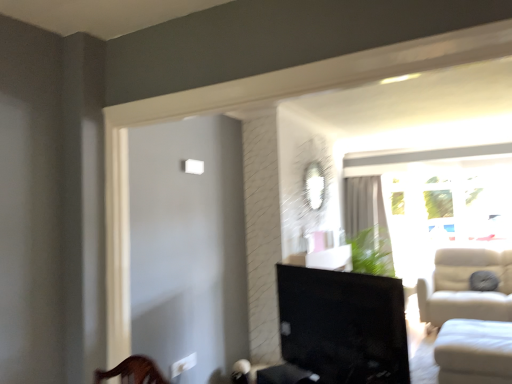
What are the coordinates of `white fabric studio couch at lower right` in the screenshot? It's located at (474, 351).

You are a GUI agent. You are given a task and a screenshot of the screen. Output one action in this format:
    pyautogui.click(x=<x>, y=<y>)
    Task: Click on the white sheer curtain at upper right
    This screenshot has width=512, height=384.
    Given the screenshot: What is the action you would take?
    pyautogui.click(x=367, y=226)

The image size is (512, 384). Describe the element at coordinates (440, 199) in the screenshot. I see `transparent glass window at right` at that location.

What is the approximate height of transparent glass window at right?

transparent glass window at right is 1.73 meters tall.

Locate an element on the screen. The image size is (512, 384). matte black tv at center is located at coordinates (343, 325).

The image size is (512, 384). What are the coordinates of `white fabric studio couch at lower right` in the screenshot? It's located at (474, 351).

Can you confirm if white fabric studio couch at lower right is wider than white sheer curtain at upper right?

Yes.

Looking at this image, who is shorter, white fabric studio couch at lower right or white sheer curtain at upper right?

white fabric studio couch at lower right.

Looking at this image, considering the relative sizes of white fabric studio couch at lower right and white sheer curtain at upper right in the image provided, is white fabric studio couch at lower right smaller than white sheer curtain at upper right?

Actually, white fabric studio couch at lower right might be larger than white sheer curtain at upper right.

Considering the sizes of objects white sheer curtain at upper right and transparent glass window at right in the image provided, who is bigger, white sheer curtain at upper right or transparent glass window at right?

transparent glass window at right is bigger.

Looking at this image, is white sheer curtain at upper right in contact with transparent glass window at right?

There is a gap between white sheer curtain at upper right and transparent glass window at right.

Considering the relative sizes of white sheer curtain at upper right and transparent glass window at right in the image provided, is white sheer curtain at upper right shorter than transparent glass window at right?

Correct, white sheer curtain at upper right is not as tall as transparent glass window at right.

In the image, there is a transparent glass window at right. Where is `curtain below it (from the image's perspective)`? Image resolution: width=512 pixels, height=384 pixels. curtain below it (from the image's perspective) is located at coordinates (367, 226).

Are matte black tv at center and white sheer curtain at upper right beside each other?

No.

How far apart are matte black tv at center and white sheer curtain at upper right?

matte black tv at center is 2.39 meters away from white sheer curtain at upper right.

In terms of width, does matte black tv at center look wider or thinner when compared to white sheer curtain at upper right?

Considering their sizes, matte black tv at center looks slimmer than white sheer curtain at upper right.

The image size is (512, 384). Identify the location of curtain located above the matte black tv at center (from the image's perspective). (367, 226).

How different are the orientations of white sheer curtain at upper right and white fabric studio couch at lower right in degrees?

0.0261 degrees.

Is white sheer curtain at upper right looking in the opposite direction of white fabric studio couch at lower right?

No.

Between point (365, 228) and point (507, 376), which one is positioned behind?

The point (365, 228) is behind.

Who is bigger, white sheer curtain at upper right or white fabric studio couch at lower right?

Bigger between the two is white fabric studio couch at lower right.

How different are the orientations of transparent glass window at right and white sheer curtain at upper right in degrees?

The angular difference between transparent glass window at right and white sheer curtain at upper right is 1.31 degrees.

In the scene shown: Which of these two, transparent glass window at right or white sheer curtain at upper right, stands taller?

Standing taller between the two is transparent glass window at right.

Can we say transparent glass window at right lies outside white sheer curtain at upper right?

transparent glass window at right is positioned outside white sheer curtain at upper right.

From a real-world perspective, is transparent glass window at right located beneath white fabric studio couch at lower right?

Actually, transparent glass window at right is physically above white fabric studio couch at lower right in the real world.

Does transparent glass window at right turn towards white fabric studio couch at lower right?

Yes, transparent glass window at right is facing white fabric studio couch at lower right.

From the image's perspective, between transparent glass window at right and white fabric studio couch at lower right, who is located below?

Result: white fabric studio couch at lower right is shown below in the image.

In the scene shown: What's the angular difference between transparent glass window at right and white fabric studio couch at lower right's facing directions?

1.29 degrees.

Identify the location of furniture below the white sheer curtain at upper right (from the image's perspective). (343, 325).

Is white sheer curtain at upper right positioned before matte black tv at center?

No, white sheer curtain at upper right is behind matte black tv at center.

Is white sheer curtain at upper right thinner than matte black tv at center?

In fact, white sheer curtain at upper right might be wider than matte black tv at center.

Is white sheer curtain at upper right to the right of matte black tv at center from the viewer's perspective?

Yes, white sheer curtain at upper right is to the right of matte black tv at center.

This screenshot has width=512, height=384. I want to click on curtain above the white fabric studio couch at lower right (from a real-world perspective), so click(367, 226).

This screenshot has width=512, height=384. In the image, there is a white sheer curtain at upper right. Find the location of `window below it (from a real-world perspective)`. window below it (from a real-world perspective) is located at coordinates (440, 199).

When comparing their distances from white sheer curtain at upper right, does matte black tv at center or transparent glass window at right seem closer?

Among the two, transparent glass window at right is located nearer to white sheer curtain at upper right.

Looking at the image, which one is located closer to white fabric studio couch at lower right, white sheer curtain at upper right or matte black tv at center?

matte black tv at center.

Based on their spatial positions, is transparent glass window at right or matte black tv at center closer to white fabric studio couch at lower right?

matte black tv at center is closer to white fabric studio couch at lower right.

When comparing their distances from transparent glass window at right, does matte black tv at center or white fabric studio couch at lower right seem further?

matte black tv at center lies further to transparent glass window at right than the other object.

Based on their spatial positions, is white sheer curtain at upper right or white fabric studio couch at lower right closer to transparent glass window at right?

white sheer curtain at upper right is positioned closer to the anchor transparent glass window at right.

Considering their positions, is transparent glass window at right positioned further to white fabric studio couch at lower right than white sheer curtain at upper right?

Among the two, transparent glass window at right is located further to white fabric studio couch at lower right.

Looking at the image, which one is located further to white fabric studio couch at lower right, matte black tv at center or transparent glass window at right?

transparent glass window at right lies further to white fabric studio couch at lower right than the other object.

Looking at the image, which one is located further to matte black tv at center, transparent glass window at right or white fabric studio couch at lower right?

Among the two, transparent glass window at right is located further to matte black tv at center.

Find the location of a particular element. The image size is (512, 384). studio couch between matte black tv at center and white sheer curtain at upper right in the front-back direction is located at coordinates (474, 351).

Find the location of `studio couch located between matte black tv at center and transparent glass window at right in the depth direction`. studio couch located between matte black tv at center and transparent glass window at right in the depth direction is located at coordinates (474, 351).

Locate an element on the screen. window between white fabric studio couch at lower right and white sheer curtain at upper right in the front-back direction is located at coordinates (440, 199).

Where is `window positioned between matte black tv at center and white sheer curtain at upper right from near to far`? The width and height of the screenshot is (512, 384). window positioned between matte black tv at center and white sheer curtain at upper right from near to far is located at coordinates (440, 199).